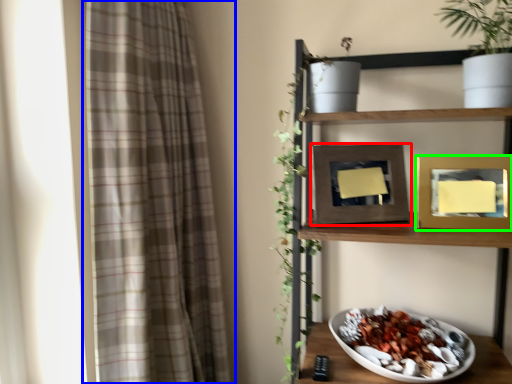
Question: Based on their relative distances, which object is nearer to picture frame (highlighted by a red box)? Choose from curtain (highlighted by a blue box) and picture frame (highlighted by a green box).

Choices:
 (A) curtain
 (B) picture frame

Answer: (B)